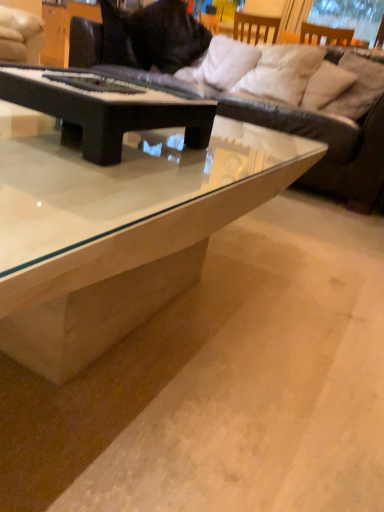
Where is `unoccupied area in front of black matte piano at center, which is the 1th coffee table from back to front`? This screenshot has height=512, width=384. unoccupied area in front of black matte piano at center, which is the 1th coffee table from back to front is located at coordinates (99, 178).